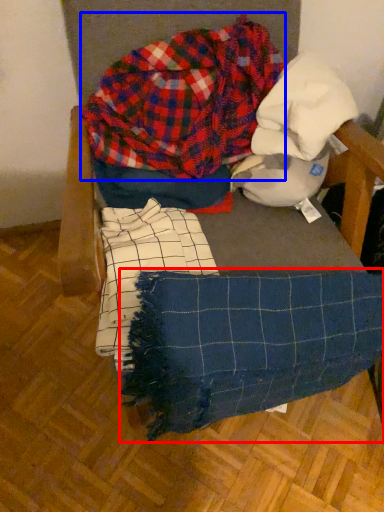
Question: Which of the following is the closest to the observer, blanket (highlighted by a red box) or flannel (highlighted by a blue box)?

Choices:
 (A) blanket
 (B) flannel

Answer: (A)